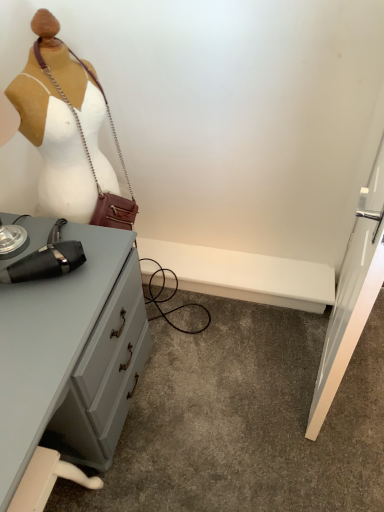
Question: Is matte gray desk at left bigger or smaller than matte black hairdryer at left?

Choices:
 (A) big
 (B) small

Answer: (A)

Question: Which is correct: matte gray desk at left is inside matte black hairdryer at left, or outside of it?

Choices:
 (A) inside
 (B) outside

Answer: (B)

Question: Is matte gray desk at left taller or shorter than matte black hairdryer at left?

Choices:
 (A) tall
 (B) short

Answer: (B)

Question: From the image's perspective, relative to matte gray desk at left, is matte black hairdryer at left above or below?

Choices:
 (A) below
 (B) above

Answer: (B)

Question: From their relative heights in the image, would you say matte black hairdryer at left is taller or shorter than matte gray desk at left?

Choices:
 (A) tall
 (B) short

Answer: (A)

Question: Would you say matte black hairdryer at left is to the left or to the right of matte gray desk at left in the picture?

Choices:
 (A) left
 (B) right

Answer: (B)

Question: From a real-world perspective, is matte black hairdryer at left above or below matte gray desk at left?

Choices:
 (A) above
 (B) below

Answer: (A)